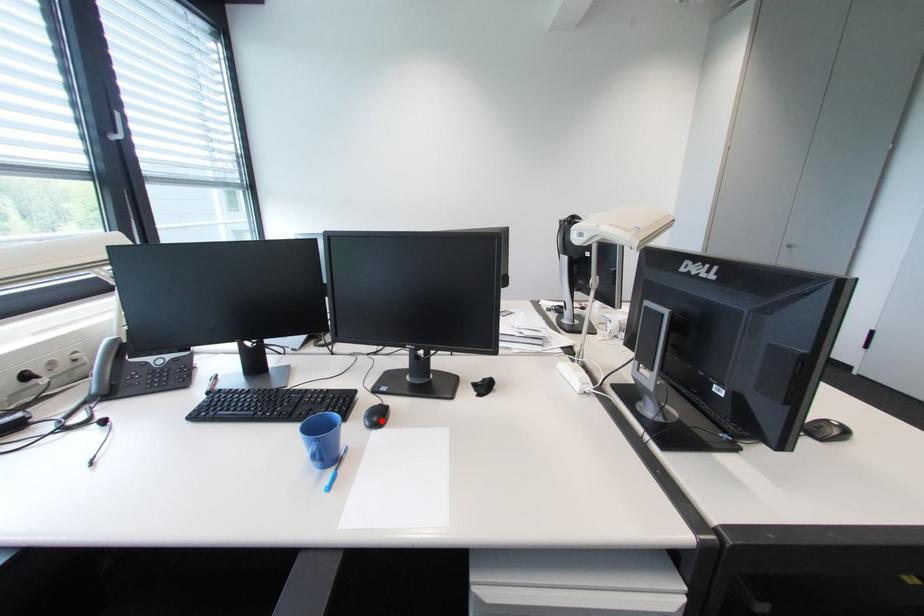
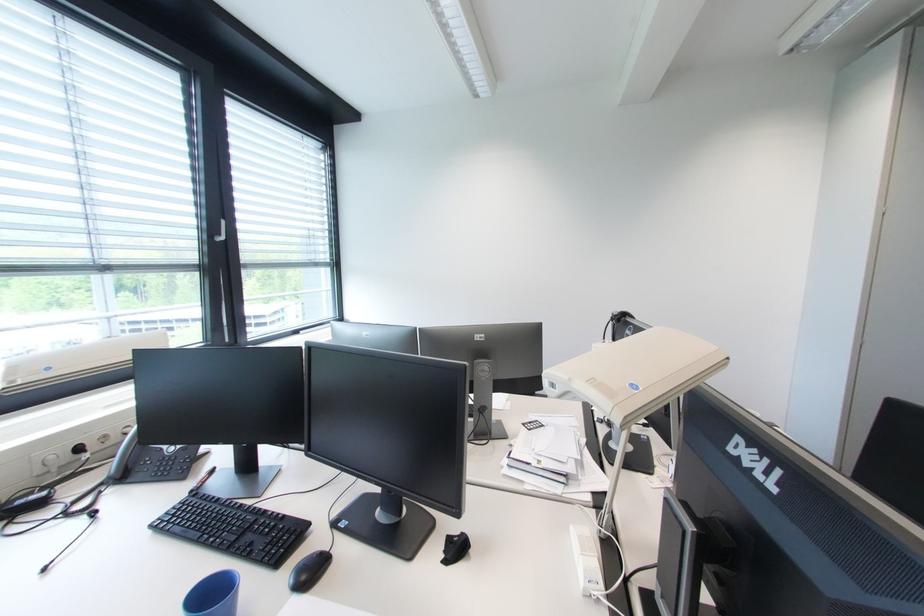
Where in the second image is the point corresponding to the highlighted location from the first image?

(310, 578)